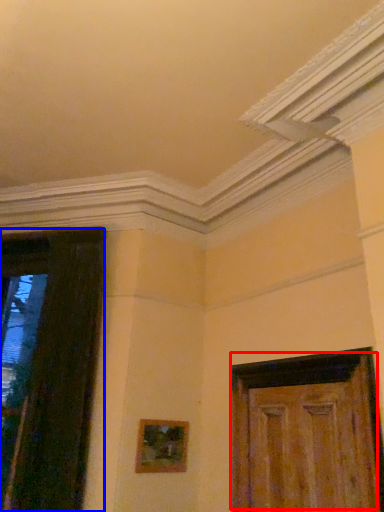
Question: Which of the following is the farthest to the observer, door (highlighted by a red box) or door (highlighted by a blue box)?

Choices:
 (A) door
 (B) door

Answer: (B)